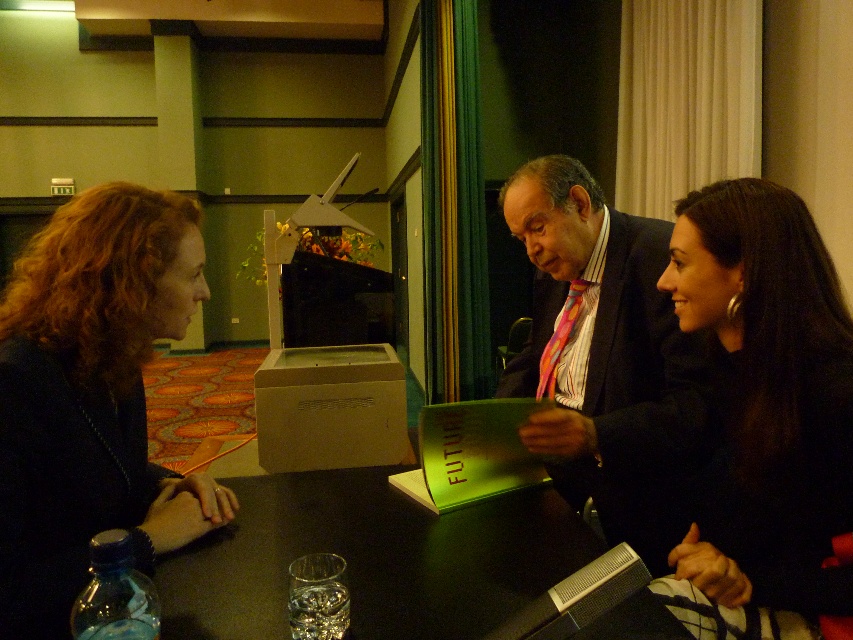
Who is higher up, dark brown hair at left or multicolored striped tie at center?

multicolored striped tie at center is above.

Who is more forward, [10,605] or [572,289]?

Point [10,605] is more forward.

Locate an element on the screen. The width and height of the screenshot is (853, 640). dark brown hair at left is located at coordinates (91, 396).

Who is taller, dark brown hair at left or shiny black hair at center?

shiny black hair at center

Does point (163, 193) lie in front of point (752, 452)?

No, (163, 193) is further to viewer.

Does point (19, 401) come in front of point (772, 182)?

Yes, it is in front of point (772, 182).

Find the location of a particular element. dark brown hair at left is located at coordinates (91, 396).

Who is positioned more to the left, shiny black hair at center or multicolored striped tie at center?

multicolored striped tie at center

Is shiny black hair at center wider than multicolored striped tie at center?

No, shiny black hair at center is not wider than multicolored striped tie at center.

Is point (724, 428) closer to viewer compared to point (567, 163)?

Yes, it is.

I want to click on shiny black hair at center, so click(766, 417).